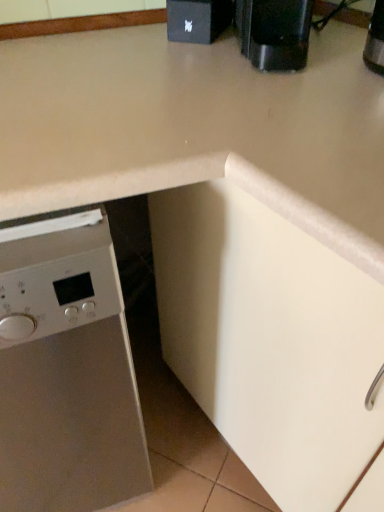
Question: Is satin white dishwasher at left facing towards black plastic coffee machine at upper right?

Choices:
 (A) yes
 (B) no

Answer: (B)

Question: Is satin white dishwasher at left positioned with its back to black plastic coffee machine at upper right?

Choices:
 (A) yes
 (B) no

Answer: (B)

Question: Can you confirm if satin white dishwasher at left is wider than black plastic coffee machine at upper right?

Choices:
 (A) no
 (B) yes

Answer: (B)

Question: Does satin white dishwasher at left lie in front of black plastic coffee machine at upper right?

Choices:
 (A) no
 (B) yes

Answer: (B)

Question: From a real-world perspective, does satin white dishwasher at left stand above black plastic coffee machine at upper right?

Choices:
 (A) no
 (B) yes

Answer: (A)

Question: Looking at their shapes, would you say satin white dishwasher at left is wider or thinner than black plastic coffee machine at upper right?

Choices:
 (A) wide
 (B) thin

Answer: (A)

Question: Is point (29, 361) closer or farther from the camera than point (297, 22)?

Choices:
 (A) farther
 (B) closer

Answer: (B)

Question: Considering their positions, is satin white dishwasher at left located in front of or behind black plastic coffee machine at upper right?

Choices:
 (A) behind
 (B) front

Answer: (B)

Question: From a real-world perspective, is satin white dishwasher at left positioned above or below black plastic coffee machine at upper right?

Choices:
 (A) above
 (B) below

Answer: (B)

Question: Is point (223, 24) positioned closer to the camera than point (86, 377)?

Choices:
 (A) closer
 (B) farther

Answer: (B)

Question: Is black matte speaker at upper center in front of or behind satin white dishwasher at left in the image?

Choices:
 (A) front
 (B) behind

Answer: (B)

Question: In terms of height, does black matte speaker at upper center look taller or shorter compared to satin white dishwasher at left?

Choices:
 (A) short
 (B) tall

Answer: (A)

Question: From the image's perspective, is black matte speaker at upper center positioned above or below satin white dishwasher at left?

Choices:
 (A) below
 (B) above

Answer: (B)

Question: Is black plastic coffee machine at upper right in front of or behind black matte speaker at upper center in the image?

Choices:
 (A) front
 (B) behind

Answer: (A)

Question: In the image, is black plastic coffee machine at upper right on the left side or the right side of black matte speaker at upper center?

Choices:
 (A) right
 (B) left

Answer: (A)